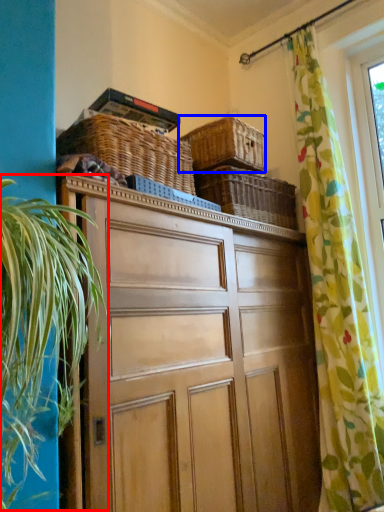
Question: Which of the following is the closest to the observer, vegetation (highlighted by a red box) or basket (highlighted by a blue box)?

Choices:
 (A) vegetation
 (B) basket

Answer: (A)